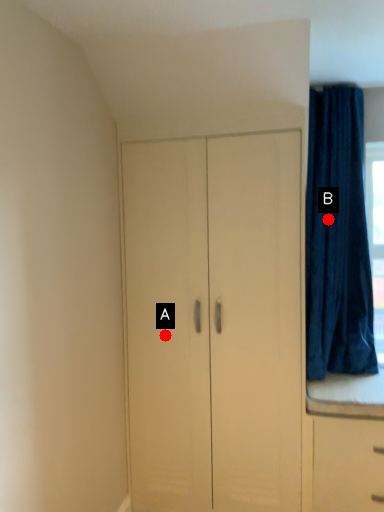
Question: Two points are circled on the image, labeled by A and B beside each circle. Which point appears closest to the camera in this image?

Choices:
 (A) A is closer
 (B) B is closer

Answer: (A)